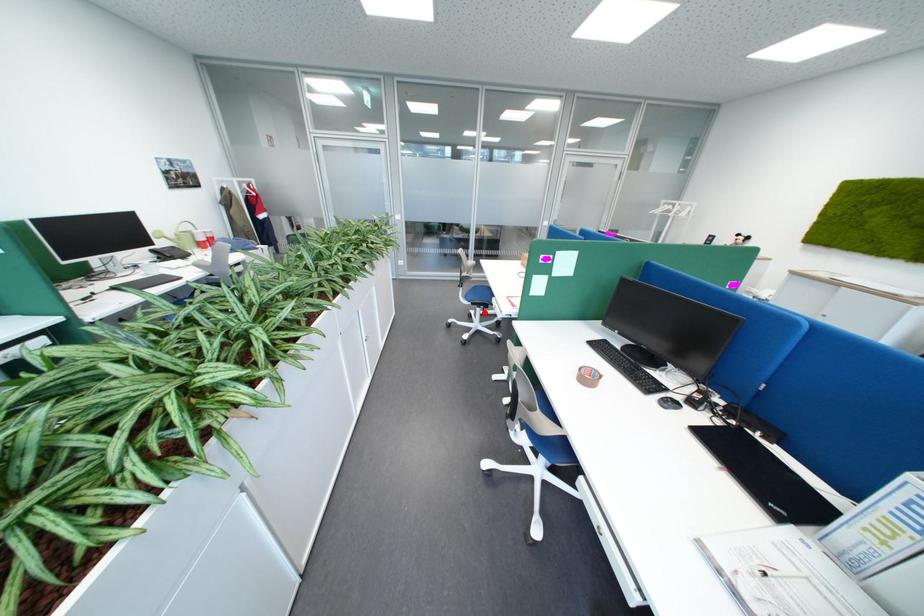
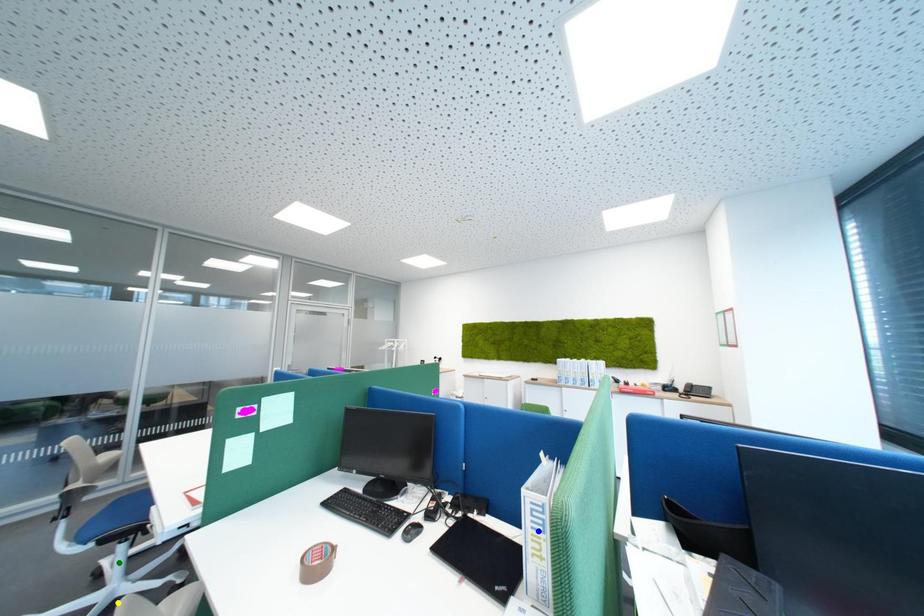
Question: I am providing you with two images of the same scene from different viewpoints. A red point is marked on the first image. You are given multiple points on the second image. Which mark in image 2 goes with the point in image 1?

Choices:
 (A) blue point
 (B) green point
 (C) yellow point

Answer: (B)